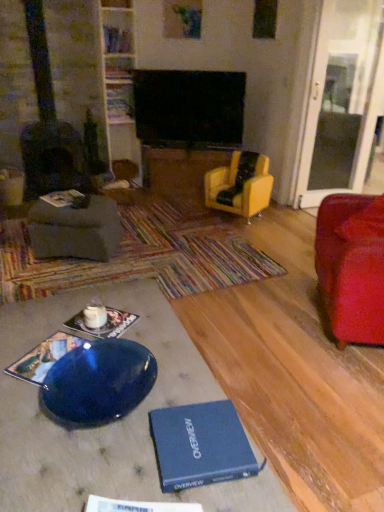
The height and width of the screenshot is (512, 384). Describe the element at coordinates (342, 99) in the screenshot. I see `transparent glass door at right` at that location.

Locate an element on the screen. hardcover book at upper center, the sixth book from the front is located at coordinates (119, 72).

What is the approximate width of multicolored woven mat at center?

It is 1.70 meters.

Locate an element on the screen. This screenshot has width=384, height=512. hardcover book at upper center, the 2th book viewed from the back is located at coordinates (117, 40).

This screenshot has width=384, height=512. Describe the element at coordinates (200, 445) in the screenshot. I see `blue hardcover book at lower center` at that location.

What do you see at coordinates (104, 324) in the screenshot?
I see `matte black book at center, the fourth book when ordered from back to front` at bounding box center [104, 324].

The width and height of the screenshot is (384, 512). What are the coordinates of `transparent glass door at right` in the screenshot? It's located at (342, 99).

Is there a large distance between blue hardcover book at lower center, arranged as the 1th book when viewed from the front, and matte black book at center, the fourth book when ordered from top to bottom?

No, blue hardcover book at lower center, arranged as the 1th book when viewed from the front, is not far away from matte black book at center, the fourth book when ordered from top to bottom.

How different are the orientations of blue hardcover book at lower center, which appears as the first book when ordered from the bottom, and matte black book at center, the third book viewed from the front, in degrees?

There is a 26.5-degree angle between the facing directions of blue hardcover book at lower center, which appears as the first book when ordered from the bottom, and matte black book at center, the third book viewed from the front.

In order to click on the 2nd book below the blue hardcover book at lower center, placed as the sixth book when sorted from top to bottom (from a real-world perspective) in this screenshot , I will do `click(104, 324)`.

Which point is more distant from viewer, (x=103, y=504) or (x=78, y=327)?

The point (x=78, y=327) is more distant.

Based on the photo, considering the relative sizes of transparent glass door at right and velvet red armchair at right, which appears as the first chair when viewed from the right, in the image provided, is transparent glass door at right taller than velvet red armchair at right, which appears as the first chair when viewed from the right,?

Yes.

Which is nearer, [357,153] or [333,309]?

Clearly, point [357,153] is more distant from the camera than point [333,309].

From a real-world perspective, who is located higher, transparent glass door at right or velvet red armchair at right, which appears as the first chair when viewed from the right?

transparent glass door at right, from a real-world perspective.

Is hardcover book at upper center, the first book from the top, positioned far away from matte black book at center, the fourth book when ordered from back to front?

Yes, hardcover book at upper center, the first book from the top, is far from matte black book at center, the fourth book when ordered from back to front.

Is hardcover book at upper center, the sixth book from the bottom, completely or partially outside of matte black book at center, the third book viewed from the front?

Indeed, hardcover book at upper center, the sixth book from the bottom, is completely outside matte black book at center, the third book viewed from the front.

Between hardcover book at upper center, the sixth book from the bottom, and matte black book at center, the fourth book when ordered from back to front, which one has larger size?

With larger size is hardcover book at upper center, the sixth book from the bottom.

From the image's perspective, is hardcover book at upper center, the first book from the top, beneath matte black book at center, which is counted as the 3th book, starting from the bottom?

No.

Is hardcover book at upper center, the first book from the top, inside velvet red armchair at right, marked as the 1th chair in a front-to-back arrangement?

Definitely not — hardcover book at upper center, the first book from the top, is not inside velvet red armchair at right, marked as the 1th chair in a front-to-back arrangement.

From a real-world perspective, is velvet red armchair at right, which is the 2th chair in back-to-front order, above or below hardcover book at upper center, the 2th book viewed from the back?

velvet red armchair at right, which is the 2th chair in back-to-front order, is below hardcover book at upper center, the 2th book viewed from the back.

Between velvet red armchair at right, which appears as the first chair when viewed from the right, and hardcover book at upper center, the 2th book viewed from the back, which one appears on the right side from the viewer's perspective?

velvet red armchair at right, which appears as the first chair when viewed from the right, is more to the right.

Is velvet red armchair at right, marked as the 1th chair in a front-to-back arrangement, further to the viewer compared to hardcover book at upper center, the sixth book from the bottom?

No, velvet red armchair at right, marked as the 1th chair in a front-to-back arrangement, is closer to the camera.

At what (x,y) coordinates should I click in order to perform the action: click on table below the matte black book at center, which is counted as the 3th book, starting from the bottom (from a real-world perspective). Please return your answer as a coordinate pair (x, y). The width and height of the screenshot is (384, 512). Looking at the image, I should click on (111, 423).

Can you tell me how much matte black book at center, which is counted as the 3th book, starting from the bottom, and glossy blue plate at lower left differ in facing direction?

There is a 40.4-degree angle between the facing directions of matte black book at center, which is counted as the 3th book, starting from the bottom, and glossy blue plate at lower left.

Are matte black book at center, the third book viewed from the front, and glossy blue plate at lower left located far from each other?

matte black book at center, the third book viewed from the front, is near glossy blue plate at lower left, not far away.

Between matte black book at center, the fourth book when ordered from top to bottom, and glossy blue plate at lower left, which one has smaller width?

With smaller width is matte black book at center, the fourth book when ordered from top to bottom.

Looking at this image, does yellow leather armchair at center, which is the first chair in left-to-right order, have a smaller size compared to hardcover book at left, positioned as the third book in back-to-front order?

No.

Based on the photo, considering the sizes of objects yellow leather armchair at center, marked as the second chair in a front-to-back arrangement, and hardcover book at left, positioned as the third book in back-to-front order, in the image provided, who is wider, yellow leather armchair at center, marked as the second chair in a front-to-back arrangement, or hardcover book at left, positioned as the third book in back-to-front order,?

With larger width is yellow leather armchair at center, marked as the second chair in a front-to-back arrangement.

Which object is closer to the camera taking this photo, yellow leather armchair at center, which is the first chair in left-to-right order, or hardcover book at left, the fourth book viewed from the front?

hardcover book at left, the fourth book viewed from the front.

Could you measure the distance between yellow leather armchair at center, marked as the second chair in a front-to-back arrangement, and hardcover book at left, positioned as the third book in back-to-front order?

yellow leather armchair at center, marked as the second chair in a front-to-back arrangement, and hardcover book at left, positioned as the third book in back-to-front order, are 4.56 feet apart from each other.

This screenshot has height=512, width=384. I want to click on book that is the 1st one when counting forward from the velvet red armchair at right, which is the 2th chair in back-to-front order, so click(x=44, y=357).

Which of these two, velvet red armchair at right, marked as the 1th chair in a front-to-back arrangement, or blue hardcover book at lower left, the fifth book in the top-to-bottom sequence, stands taller?

velvet red armchair at right, marked as the 1th chair in a front-to-back arrangement.

How distant is velvet red armchair at right, the 2th chair from the left, from blue hardcover book at lower left, the 2th book when ordered from bottom to top?

velvet red armchair at right, the 2th chair from the left, is 1.41 meters from blue hardcover book at lower left, the 2th book when ordered from bottom to top.

Considering the points (367, 315) and (77, 344), which point is in front, point (367, 315) or point (77, 344)?

The point (77, 344) is closer.

From the image's perspective, which book is the 2nd one below the matte black book at center, the third book viewed from the front? Please provide its 2D coordinates.

[(137, 506)]

At what (x,y) coordinates should I click in order to perform the action: click on the 1st chair counting from the left of the transparent glass door at right. Please return your answer as a coordinate pair (x, y). The width and height of the screenshot is (384, 512). Looking at the image, I should click on (352, 266).

When comparing their distances from hardcover book at upper center, the sixth book from the bottom, does velvet red armchair at right, which is the 2th chair in back-to-front order, or hardcover book at left, the 3th book from the top, seem closer?

Among the two, hardcover book at left, the 3th book from the top, is located nearer to hardcover book at upper center, the sixth book from the bottom.

Estimate the real-world distances between objects in this image. Which object is further from transparent glass door at right, glossy blue plate at lower left or matte black book at center, the third book viewed from the front?

Among the two, matte black book at center, the third book viewed from the front, is located further to transparent glass door at right.

Looking at the image, which one is located further to hardcover book at left, positioned as the third book in back-to-front order, blue hardcover book at lower center, which ranks as the 6th book in back-to-front order, or blue hardcover book at lower center?

blue hardcover book at lower center, which ranks as the 6th book in back-to-front order, is further to hardcover book at left, positioned as the third book in back-to-front order.

Estimate the real-world distances between objects in this image. Which object is closer to transparent glass door at right, glossy blue plate at lower left or blue hardcover book at lower center?

The object closer to transparent glass door at right is glossy blue plate at lower left.

Which object lies nearer to the anchor point matte gray footrest at left, yellow leather armchair at center, acting as the 1th chair starting from the back, or hardcover book at upper center, the sixth book from the bottom?

yellow leather armchair at center, acting as the 1th chair starting from the back, is positioned closer to the anchor matte gray footrest at left.

Which object lies nearer to the anchor point glossy blue plate at lower left, matte black book at center, the third book viewed from the front, or multicolored woven mat at center?

matte black book at center, the third book viewed from the front, is positioned closer to the anchor glossy blue plate at lower left.

Which object lies nearer to the anchor point hardcover book at upper center, which is counted as the 5th book, starting from the bottom, blue hardcover book at lower left, the fifth book in the top-to-bottom sequence, or velvet red armchair at right, which is the 2th chair in back-to-front order?

Based on the image, velvet red armchair at right, which is the 2th chair in back-to-front order, appears to be nearer to hardcover book at upper center, which is counted as the 5th book, starting from the bottom.

Considering their positions, is matte black book at center, the third book viewed from the front, positioned further to velvet red armchair at right, marked as the 1th chair in a front-to-back arrangement, than blue hardcover book at lower left, which is counted as the second book, starting from the front?

Among the two, blue hardcover book at lower left, which is counted as the second book, starting from the front, is located further to velvet red armchair at right, marked as the 1th chair in a front-to-back arrangement.

Locate an element on the screen. The image size is (384, 512). magazine located between glossy blue plate at lower left and hardcover book at upper center, the 2th book viewed from the top, in the depth direction is located at coordinates (200, 445).

At what (x,y) coordinates should I click in order to perform the action: click on mat positioned between blue hardcover book at lower center and matte gray footrest at left from near to far. Please return your answer as a coordinate pair (x, y). The height and width of the screenshot is (512, 384). Looking at the image, I should click on (142, 256).

Find the location of `the footrest located between glossy blue plate at lower left and yellow leather armchair at center, marked as the 2th chair in a right-to-left arrangement, in the depth direction`. the footrest located between glossy blue plate at lower left and yellow leather armchair at center, marked as the 2th chair in a right-to-left arrangement, in the depth direction is located at coordinates (75, 230).

Find the location of a particular element. mat between glossy blue plate at lower left and yellow leather armchair at center, marked as the second chair in a front-to-back arrangement, in the front-back direction is located at coordinates (142, 256).